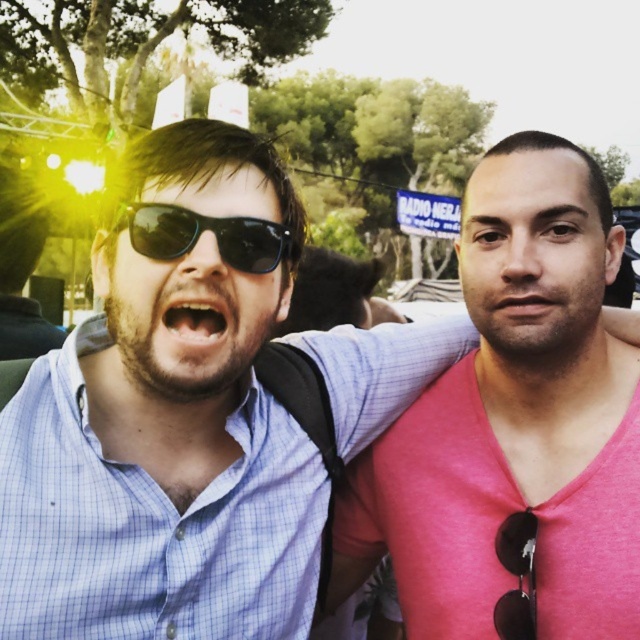
Question: Where is black plastic sunglasses at center located in relation to white glossy teeth at center in the image?

Choices:
 (A) right
 (B) left

Answer: (A)

Question: Is pink matte skin at center above blue checkered shirt at left?

Choices:
 (A) yes
 (B) no

Answer: (A)

Question: Which point is farther to the camera?

Choices:
 (A) pink matte skin at center
 (B) black plastic sunglasses at center
 (C) matte black sunglasses at center
 (D) white glossy teeth at center

Answer: (A)

Question: Among these points, which one is nearest to the camera?

Choices:
 (A) (99, 316)
 (B) (179, 234)

Answer: (B)

Question: Does black plastic sunglasses at center lie behind blue checkered shirt at left?

Choices:
 (A) no
 (B) yes

Answer: (B)

Question: Which object appears closest to the camera in this image?

Choices:
 (A) blue checkered shirt at left
 (B) matte black sunglasses at center
 (C) white glossy teeth at center

Answer: (B)